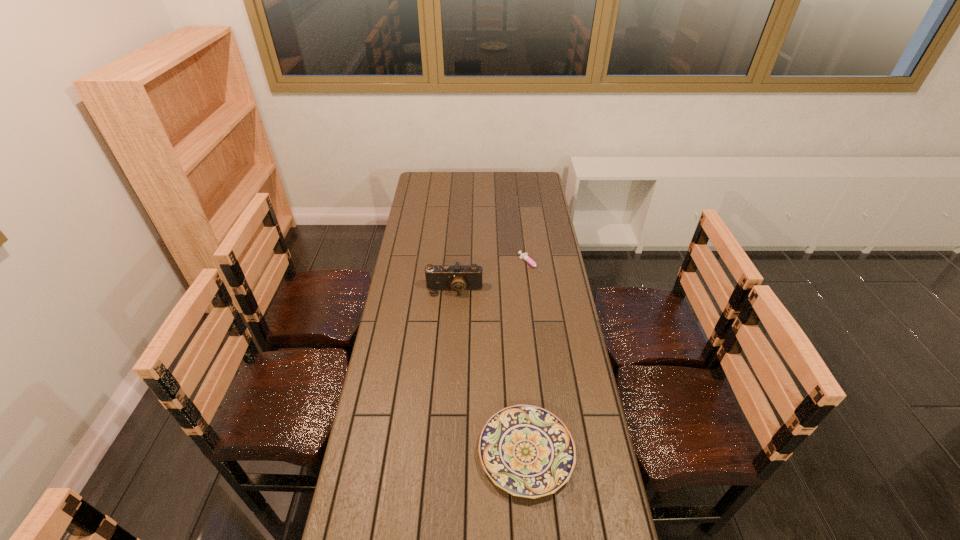
The image size is (960, 540). In order to click on object that stands as the closest to the tallest object in this screenshot , I will do `click(524, 256)`.

Identify the location of free space in the image that satisfies the following two spatial constraints: 1. on the front-facing side of the plate; 2. on the left side of the tallest object. (444, 453).